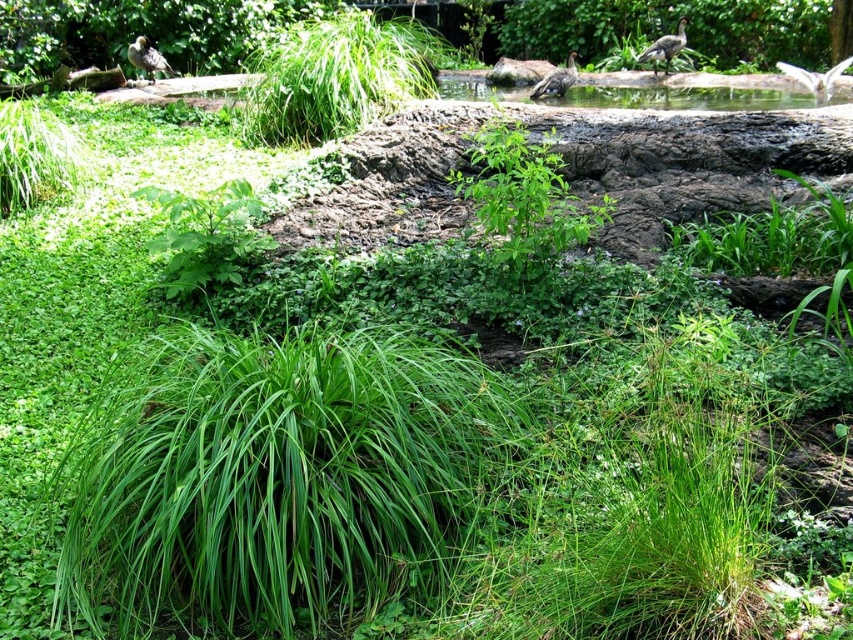
Does gray feathered bird at upper right have a larger size compared to brown feathered bird at upper left?

Yes.

Who is taller, gray feathered bird at upper right or brown feathered bird at upper left?

gray feathered bird at upper right is taller.

What are the coordinates of `gray feathered bird at upper right` in the screenshot? It's located at (665, 45).

Which is behind, point (498, 74) or point (677, 44)?

Positioned behind is point (498, 74).

Which is above, brown fuzzy rock at center or gray feathered bird at upper right?

Positioned higher is gray feathered bird at upper right.

Is point (494, 80) farther from viewer compared to point (674, 42)?

That is True.

At what (x,y) coordinates should I click in order to perform the action: click on brown fuzzy rock at center. Please return your answer as a coordinate pair (x, y). The width and height of the screenshot is (853, 640). Looking at the image, I should click on (517, 72).

Is point (780, 68) behind point (569, 52)?

That is False.

Is point (811, 83) positioned behind point (550, 93)?

That is False.

The image size is (853, 640). Find the location of `white feathered bird at upper right`. white feathered bird at upper right is located at coordinates tap(815, 77).